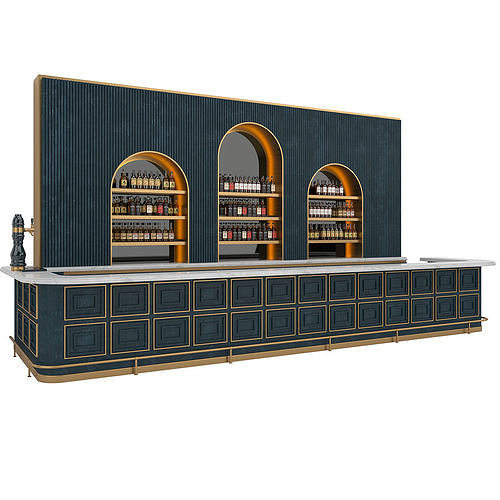
The image size is (500, 500). In order to click on gold edge of top left corner of  bar back in this screenshot , I will do `click(39, 82)`.